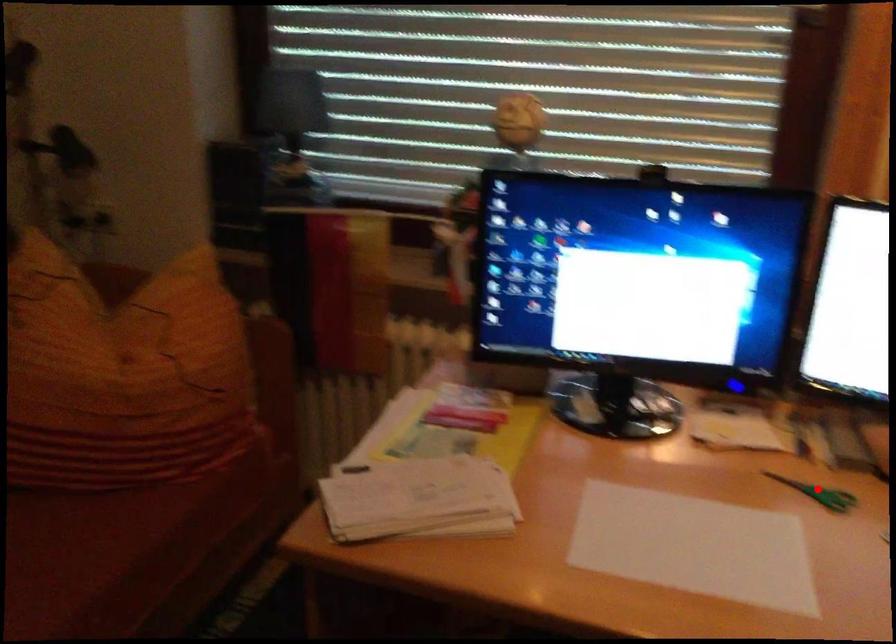
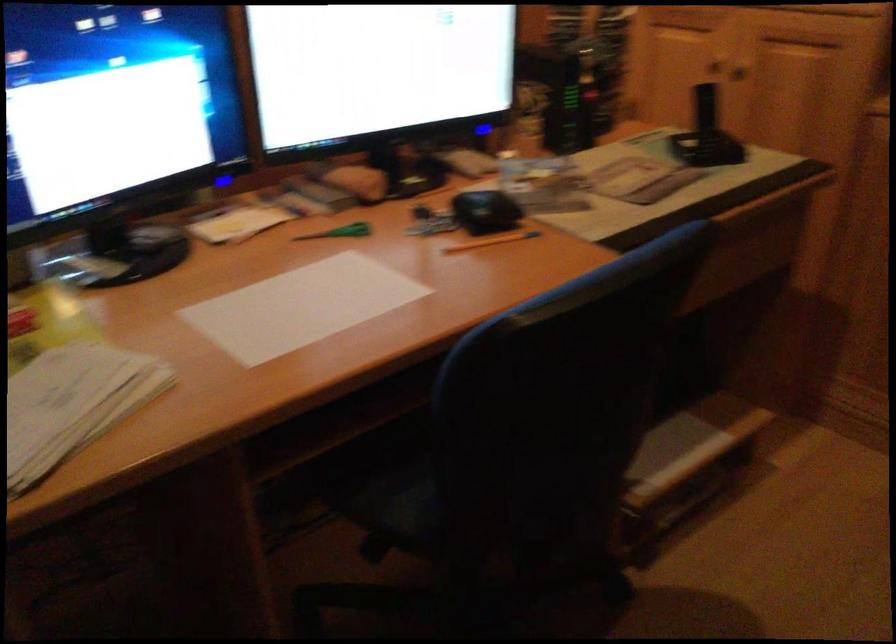
The point at the highlighted location is marked in the first image. Where is the corresponding point in the second image?

(340, 232)